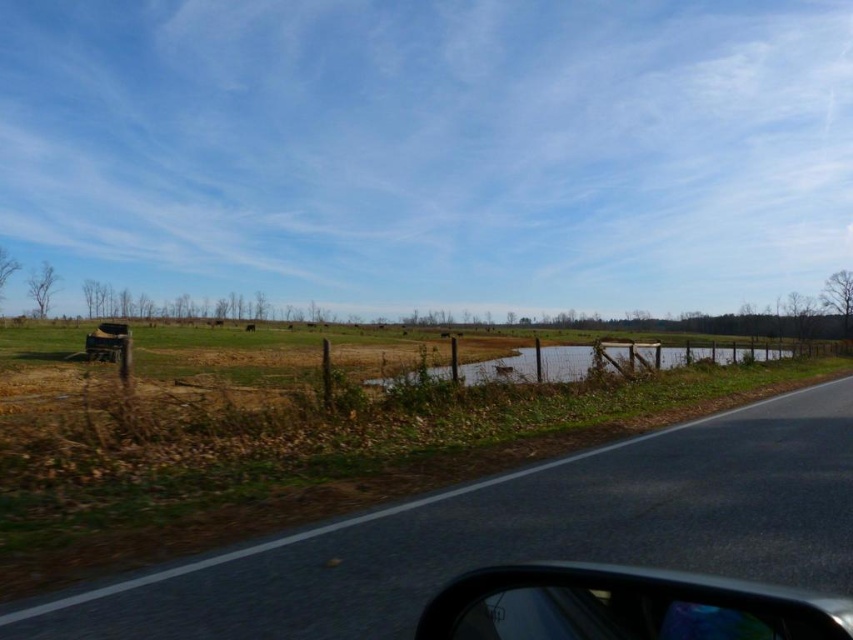
You are driving a vehicle and want to park it between the glossy plastic car at lower right and the brushed metal jeep at lower left. Which vehicle should you move closer to if you want to park as close as possible to the road without overlapping either vehicle?

You should move closer to the brushed metal jeep at lower left because the glossy plastic car at lower right might be wider than the brushed metal jeep at lower left, so there might be more space near the jeep to park without overlapping.

You are driving a vehicle and want to park near the fence. You see a glossy plastic car at lower right and a brushed metal jeep at lower left. Which vehicle is closer to the fence on the right side?

The glossy plastic car at lower right is positioned on the right side of the brushed metal jeep at lower left, so it is closer to the fence on the right side.

You are driving a car and see the asphalt road at lower right and the brushed metal jeep at lower left in your view. Which object is closer to the bottom edge of your windshield?

The asphalt road at lower right is closer to the bottom edge of your windshield because it is located below the brushed metal jeep at lower left.